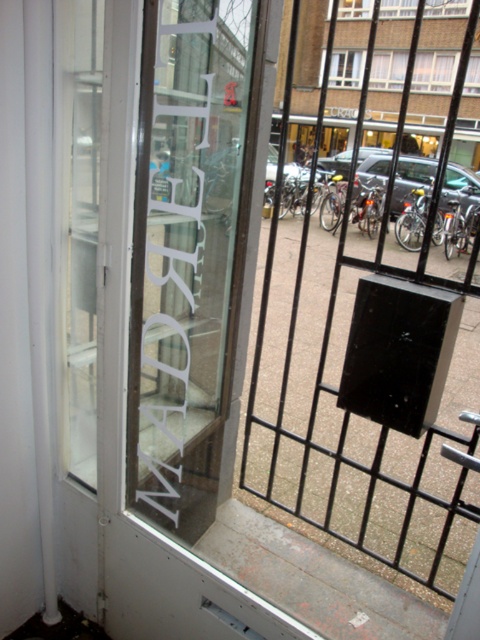
You are standing in a room and want to look outside through the transparent glass sign at upper left and the transparent glass window at center. Which one allows you to see further into the street?

The transparent glass window at center allows you to see further into the street because it is farther from the viewer than the transparent glass sign at upper left.

You are a delivery person trying to see the address written on the transparent glass sign at upper left and the transparent glass window at center. Which one is easier to read from your current position?

The transparent glass window at center is easier to read because it is above the transparent glass sign at upper left, making it more visible from your current position.

You are standing in front of the window with the metal security gate and the glass panel labeled MADRAZ. You notice two points marked on the glass at coordinates point (x=173, y=392) and point (x=458, y=3). If you were to touch both points with your finger, which point would require your hand to be closer to the window?

Point (x=173, y=392) is closer to the camera than point (x=458, y=3), so touching point (x=173, y=392) would require your hand to be closer to the window.